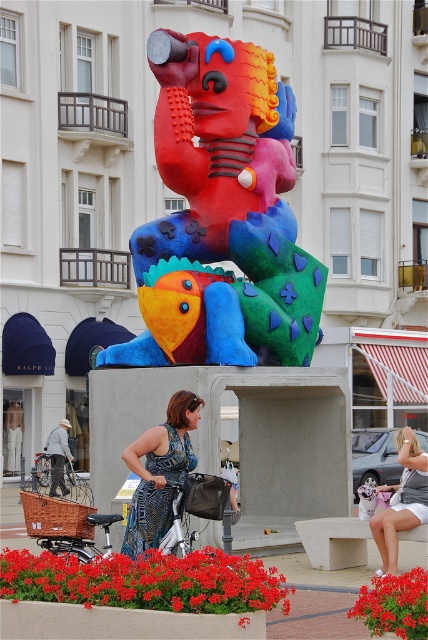
You are an urban planner reviewing a city park layout. The park has a large colorful sculpture and a planter with red flowers. You need to place a new bench in the park such that it is exactly at the coordinates point [222,216]. Is this possible? Explain why or why not using the scene description.

The point [222,216] is already occupied by the matte plastic sculpture at center, so placing a bench there is not possible.

You are standing at the entrance of the park and see the matte plastic sculpture at center and the vibrant red petals at center. If you want to take a photo of both objects in the same frame, which one should you move closer to and which one should you move away from?

The matte plastic sculpture at center is 59.33 feet away from vibrant red petals at center. To capture both in the same frame, you should move closer to the vibrant red petals at center and move away from the matte plastic sculpture at center to ensure both are in focus and within the frame.

Looking at this image, you are standing in front of the sculpture and want to take a photo of the white cotton shorts at lower right. Where should you position yourself to ensure the shorts are in the frame?

Position yourself so that your camera is aimed at the coordinates corresponding to point (401, 500) to capture the white cotton shorts at lower right in the frame.